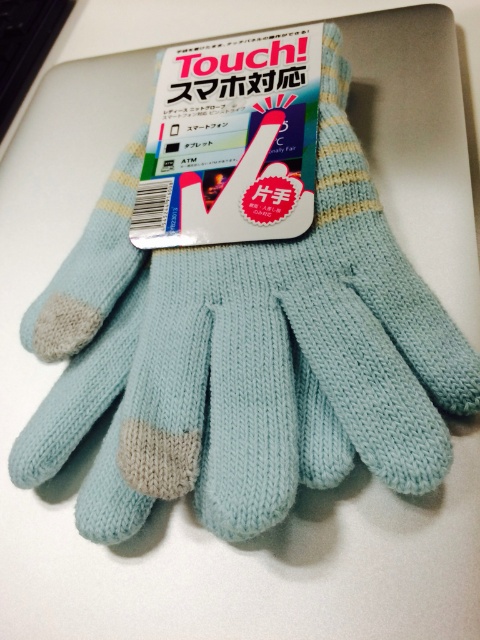
How far apart are matte blue knitted gloves at center and black plastic keyboard at upper left?

matte blue knitted gloves at center is 19.01 inches away from black plastic keyboard at upper left.

Is matte blue knitted gloves at center below black plastic keyboard at upper left?

Yes, matte blue knitted gloves at center is below black plastic keyboard at upper left.

I want to click on matte blue knitted gloves at center, so click(230, 141).